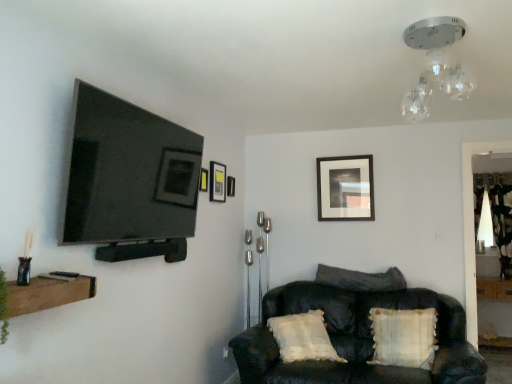
Question: In terms of width, does matte black picture frame at upper center, placed as the 1th picture frame when sorted from back to front, look wider or thinner when compared to clear glass light fixture at upper center, arranged as the first light fixture when viewed from the left?

Choices:
 (A) wide
 (B) thin

Answer: (B)

Question: From a real-world perspective, is matte black picture frame at upper center, placed as the 1th picture frame when sorted from back to front, physically located above or below clear glass light fixture at upper center, which ranks as the first light fixture in front-to-back order?

Choices:
 (A) above
 (B) below

Answer: (B)

Question: Estimate the real-world distances between objects in this image. Which object is closer to the matte black picture frame at upper center, the first picture frame from the left?

Choices:
 (A) white plastic electric outlet at lower center
 (B) clear glass light fixture at upper center, which ranks as the first light fixture in front-to-back order
 (C) white textured pillow at lower right, the second pillow when ordered from back to front
 (D) matte black picture frame at upper center, acting as the third picture frame starting from the front
 (E) dark fabric pillow at center, the first pillow viewed from the top

Answer: (D)

Question: Based on their relative distances, which object is farther from the white textured pillow at lower right, which appears as the 2th pillow when viewed from the top?

Choices:
 (A) matte black tv at left
 (B) dark brown leather couch at lower right
 (C) wooden shelf at lower left
 (D) clear glass light fixture at upper center, the 1th light fixture in the top-to-bottom sequence
 (E) matte black picture frame at upper center, arranged as the second picture frame when viewed from the back

Answer: (C)